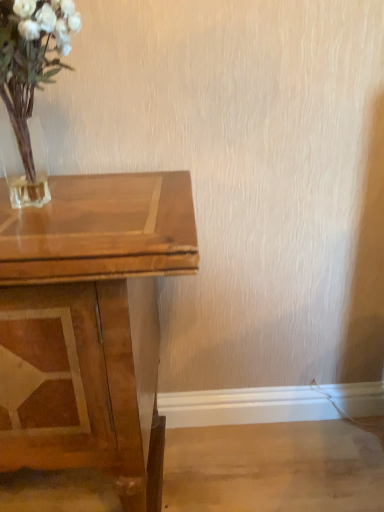
Question: Is shiny brown wooden table at left bigger or smaller than translucent glass vase at upper left?

Choices:
 (A) big
 (B) small

Answer: (A)

Question: From a real-world perspective, is shiny brown wooden table at left above or below translucent glass vase at upper left?

Choices:
 (A) below
 (B) above

Answer: (A)

Question: Visually, is shiny brown wooden table at left positioned to the left or to the right of translucent glass vase at upper left?

Choices:
 (A) left
 (B) right

Answer: (A)

Question: Considering their positions, is translucent glass vase at upper left located in front of or behind shiny brown wooden table at left?

Choices:
 (A) behind
 (B) front

Answer: (B)

Question: In terms of width, does translucent glass vase at upper left look wider or thinner when compared to shiny brown wooden table at left?

Choices:
 (A) thin
 (B) wide

Answer: (A)

Question: From the image's perspective, is translucent glass vase at upper left above or below shiny brown wooden table at left?

Choices:
 (A) below
 (B) above

Answer: (B)

Question: From their relative heights in the image, would you say translucent glass vase at upper left is taller or shorter than shiny brown wooden table at left?

Choices:
 (A) short
 (B) tall

Answer: (A)